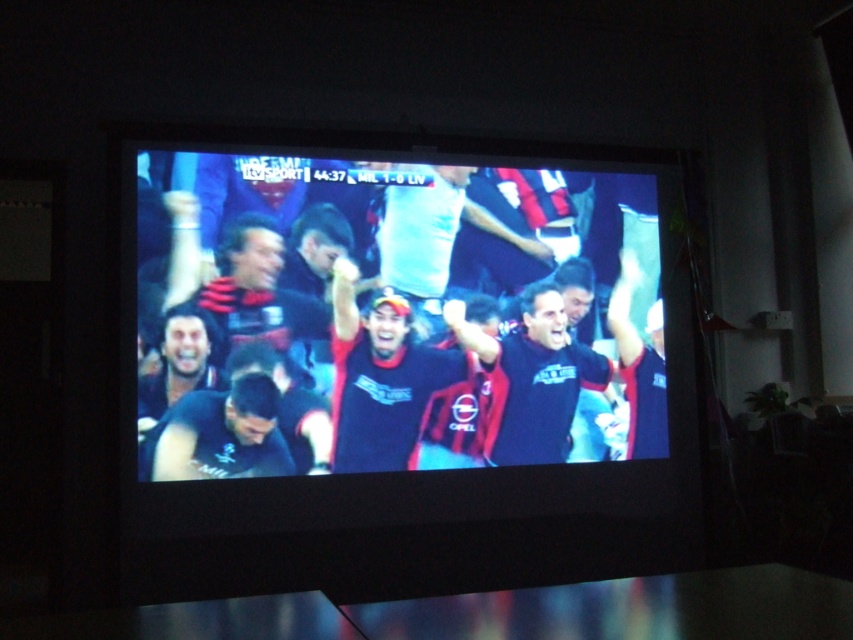
Is point (494, 378) positioned before point (218, 458)?

No, (494, 378) is behind (218, 458).

Does point (491, 413) come in front of point (194, 392)?

No.

Locate an element on the screen. The width and height of the screenshot is (853, 640). black matte shirt at center is located at coordinates (532, 380).

You are a GUI agent. You are given a task and a screenshot of the screen. Output one action in this format:
    pyautogui.click(x=<x>, y=<y>)
    Task: Click on the dark blue jersey at center
    This screenshot has height=640, width=853.
    Given the screenshot: What is the action you would take?
    coord(381,380)

Can you confirm if dark blue jersey at center is positioned to the right of matte black shirt at lower left?

Indeed, dark blue jersey at center is positioned on the right side of matte black shirt at lower left.

Locate an element on the screen. This screenshot has height=640, width=853. dark blue jersey at center is located at coordinates (381, 380).

Is black matte television at center shorter than black matte shirt at center?

No, black matte television at center is not shorter than black matte shirt at center.

Is the position of black matte television at center more distant than that of black matte shirt at center?

No, it is in front of black matte shirt at center.

Does point (142, 497) come closer to viewer compared to point (547, 307)?

Yes, point (142, 497) is closer to viewer.

You are a GUI agent. You are given a task and a screenshot of the screen. Output one action in this format:
    pyautogui.click(x=<x>, y=<y>)
    Task: Click on the black matte television at center
    The width and height of the screenshot is (853, 640).
    Given the screenshot: What is the action you would take?
    pyautogui.click(x=403, y=369)